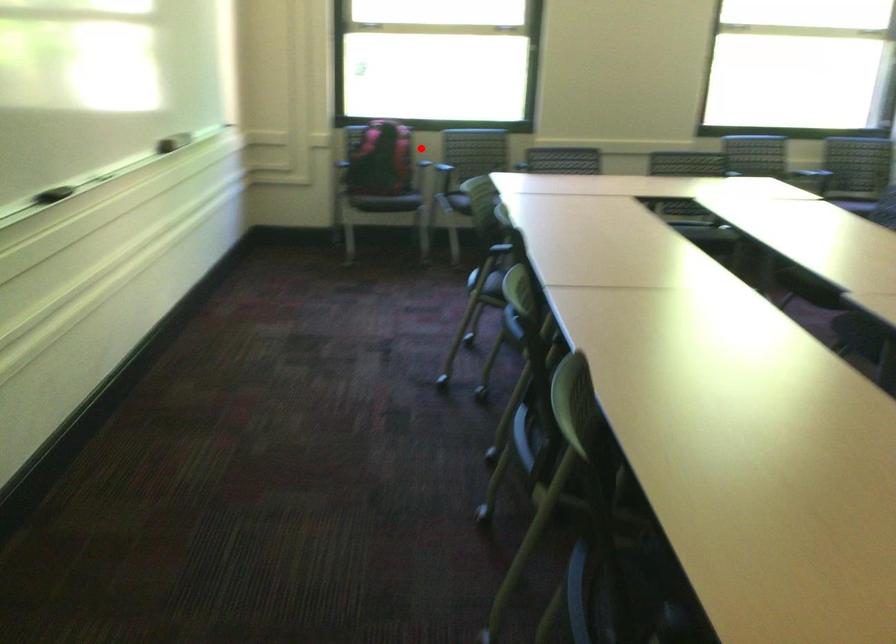
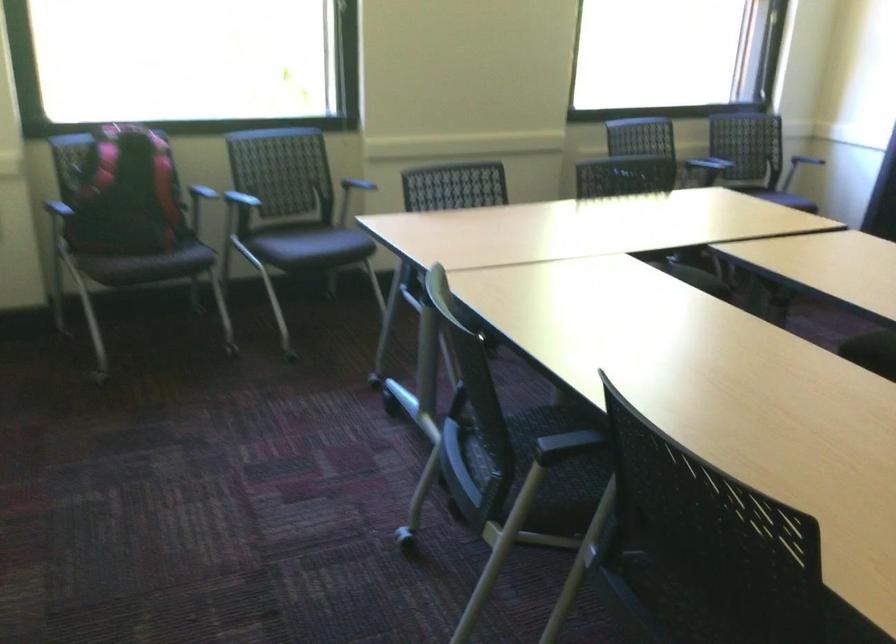
The point at the highlighted location is marked in the first image. Where is the corresponding point in the second image?

(200, 183)